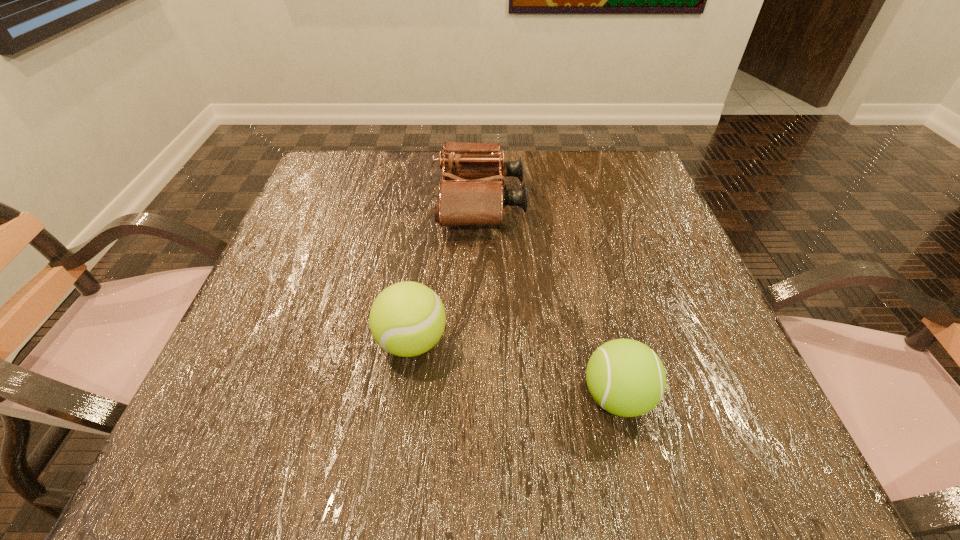
Locate an element on the screen. free space at the near edge of the desktop is located at coordinates (417, 458).

This screenshot has height=540, width=960. Find the location of `vacant space at the left edge of the desktop`. vacant space at the left edge of the desktop is located at coordinates (313, 380).

At what (x,y) coordinates should I click in order to perform the action: click on vacant space at the right edge of the desktop. Please return your answer as a coordinate pair (x, y). Looking at the image, I should click on (638, 281).

Find the location of a particular element. free space at the far left corner of the desktop is located at coordinates (304, 197).

This screenshot has height=540, width=960. Find the location of `free location at the near left corner`. free location at the near left corner is located at coordinates (264, 481).

I want to click on vacant region at the far right corner of the desktop, so click(x=623, y=157).

The image size is (960, 540). Identify the location of free space between the binoculars and the rightmost object. pyautogui.click(x=548, y=300).

Identify the location of empty location between the binoculars and the right tennis ball. (548, 300).

Where is `free spot between the left tennis ball and the binoculars`? free spot between the left tennis ball and the binoculars is located at coordinates (445, 272).

At what (x,y) coordinates should I click in order to perform the action: click on vacant area that lies between the right tennis ball and the left tennis ball. Please return your answer as a coordinate pair (x, y). The height and width of the screenshot is (540, 960). Looking at the image, I should click on (515, 369).